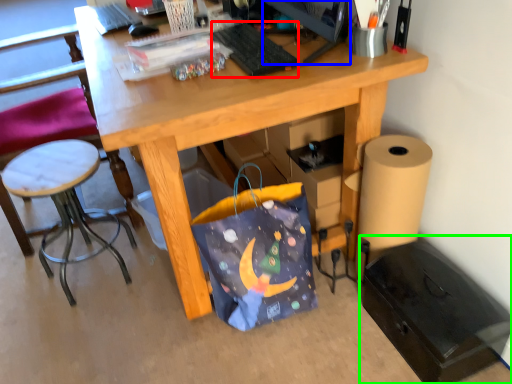
Question: Estimate the real-world distances between objects in this image. Which object is farther from keyboard (highlighted by a red box), computer monitor (highlighted by a blue box) or file cabinet (highlighted by a green box)?

Choices:
 (A) computer monitor
 (B) file cabinet

Answer: (B)